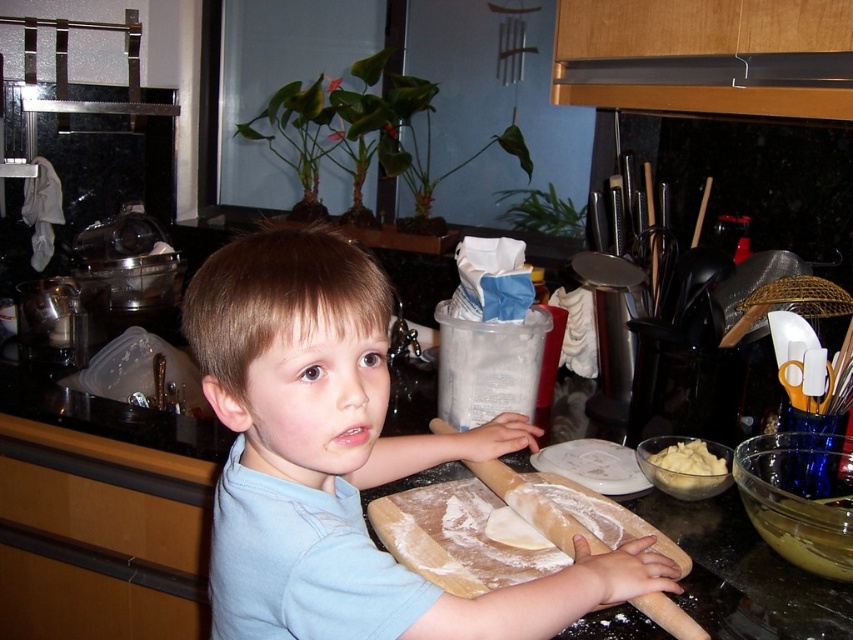
Who is more forward, (596, 538) or (724, 470)?

Point (596, 538) is in front.

Is point (511, 490) farther from camera compared to point (723, 464)?

No.

Where is `wooden rolling pin at center`? This screenshot has width=853, height=640. wooden rolling pin at center is located at coordinates (534, 506).

Which is more to the left, light blue cotton shirt at center or yellow creamy spread at center?

light blue cotton shirt at center is more to the left.

Between light blue cotton shirt at center and yellow creamy spread at center, which one is positioned lower?

yellow creamy spread at center is below.

Is point (215, 273) positioned behind point (705, 456)?

No.

The height and width of the screenshot is (640, 853). What are the coordinates of `light blue cotton shirt at center` in the screenshot? It's located at (344, 461).

Is point (230, 496) in front of point (515, 509)?

Yes.

Which is behind, point (524, 426) or point (685, 634)?

The point (524, 426) is behind.

The image size is (853, 640). I want to click on light blue cotton shirt at center, so click(344, 461).